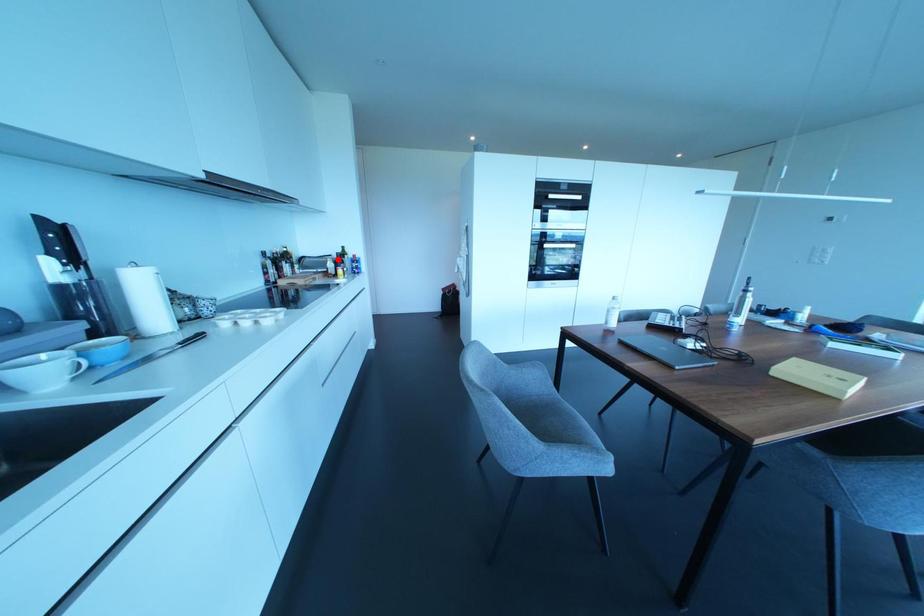
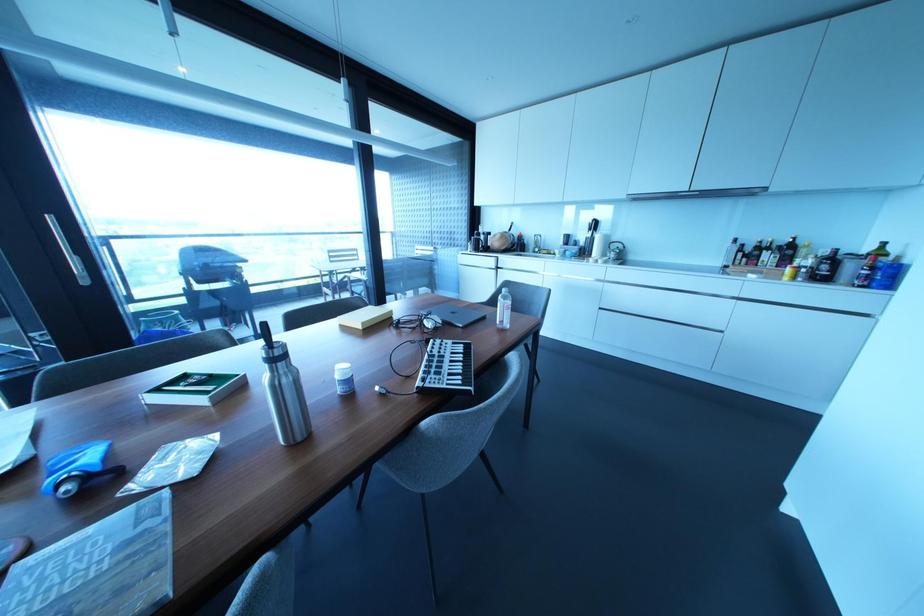
Locate, in the second image, the point that corresponds to the highlighted location in the first image.

(833, 257)